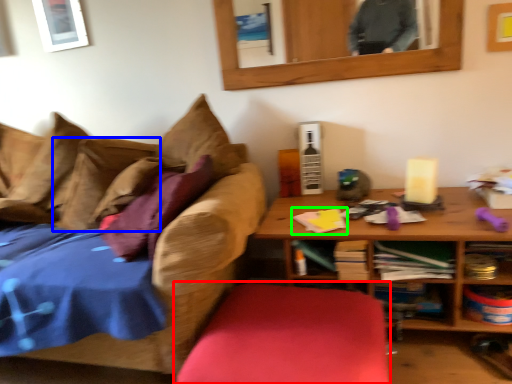
Question: Estimate the real-world distances between objects in this image. Which object is closer to swivel chair (highlighted by a red box), pillow (highlighted by a blue box) or book (highlighted by a green box)?

Choices:
 (A) pillow
 (B) book

Answer: (B)